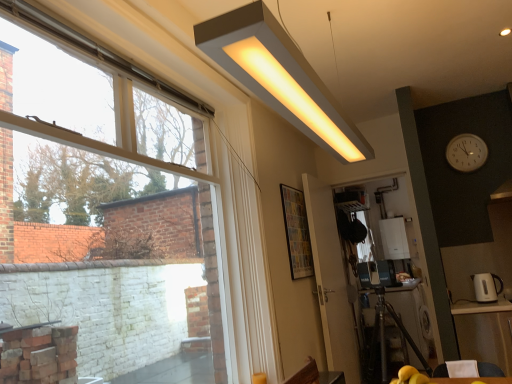
You are a GUI agent. You are given a task and a screenshot of the screen. Output one action in this format:
    pyautogui.click(x=<x>, y=<y>)
    Task: Click on the free spot above white glossy screen door at lower right, positioned as the first screen door in right-to-left order (from a real-world perspective)
    
    Given the screenshot: What is the action you would take?
    pyautogui.click(x=362, y=169)